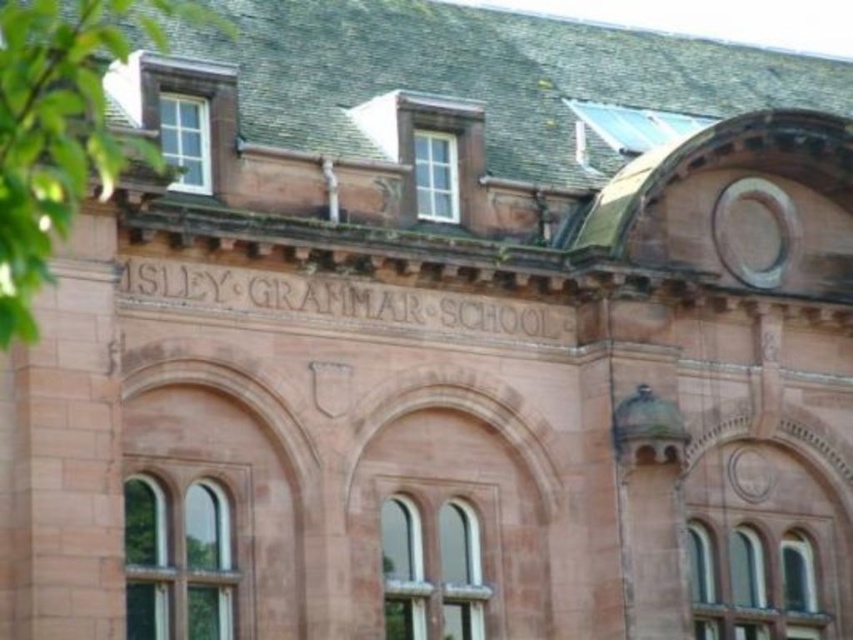
Is brown stone engraving at center taller than matte brown window at upper center?

Incorrect, brown stone engraving at center's height is not larger of matte brown window at upper center's.

Which is more to the right, brown stone engraving at center or matte brown window at upper center?

matte brown window at upper center is more to the right.

Find the location of a particular element. Image resolution: width=853 pixels, height=640 pixels. brown stone engraving at center is located at coordinates pyautogui.click(x=343, y=300).

Identify the location of brown stone engraving at center. The height and width of the screenshot is (640, 853). (343, 300).

Between brown stone engraving at center and white wood window at upper center, which one appears on the right side from the viewer's perspective?

From the viewer's perspective, brown stone engraving at center appears more on the right side.

Does point (514, 316) come farther from viewer compared to point (161, 100)?

Yes, it is.

Locate an element on the screen. The height and width of the screenshot is (640, 853). brown stone engraving at center is located at coordinates (343, 300).

Can you confirm if brown stone engraving at center is bigger than clear glass window at center?

Yes, brown stone engraving at center is bigger than clear glass window at center.

Who is more forward, (483, 305) or (706, 600)?

Point (483, 305) is in front.

You are a GUI agent. You are given a task and a screenshot of the screen. Output one action in this format:
    pyautogui.click(x=<x>, y=<y>)
    Task: Click on the brown stone engraving at center
    This screenshot has height=640, width=853.
    Given the screenshot: What is the action you would take?
    pyautogui.click(x=343, y=300)